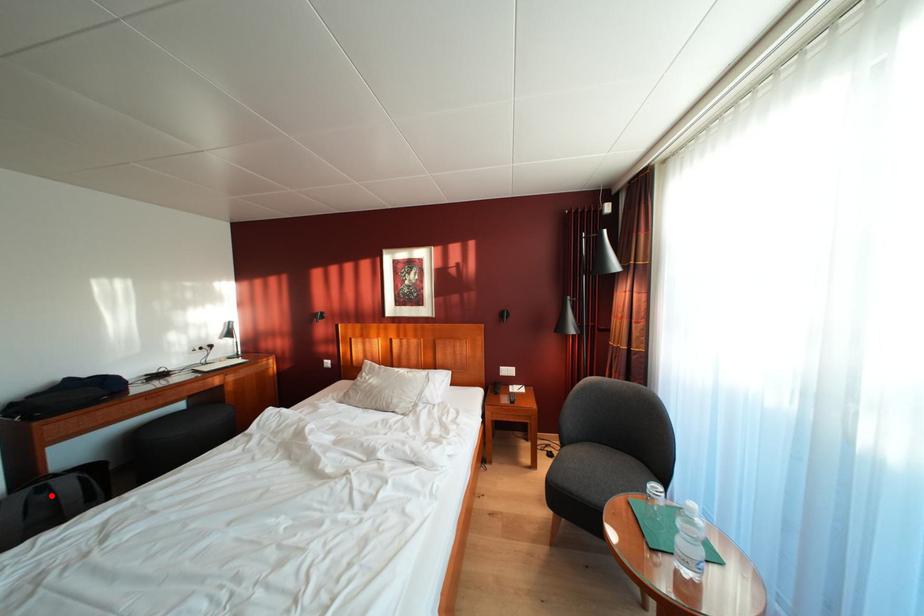
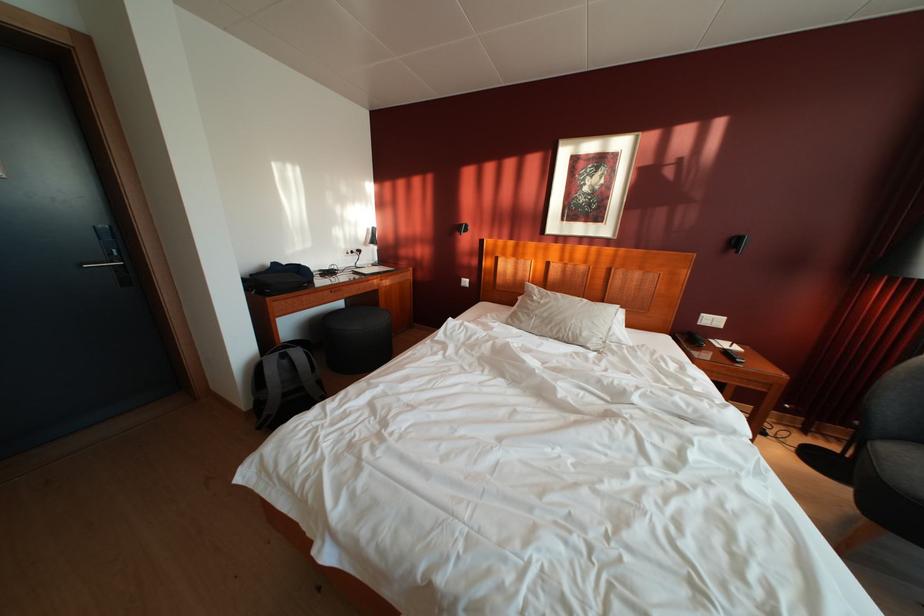
Question: I am providing you with two images of the same scene from different viewpoints. In image1, a red point is highlighted. Considering the same 3D point in image2, which of the following is correct?

Choices:
 (A) It is closer
 (B) It is farther

Answer: (A)